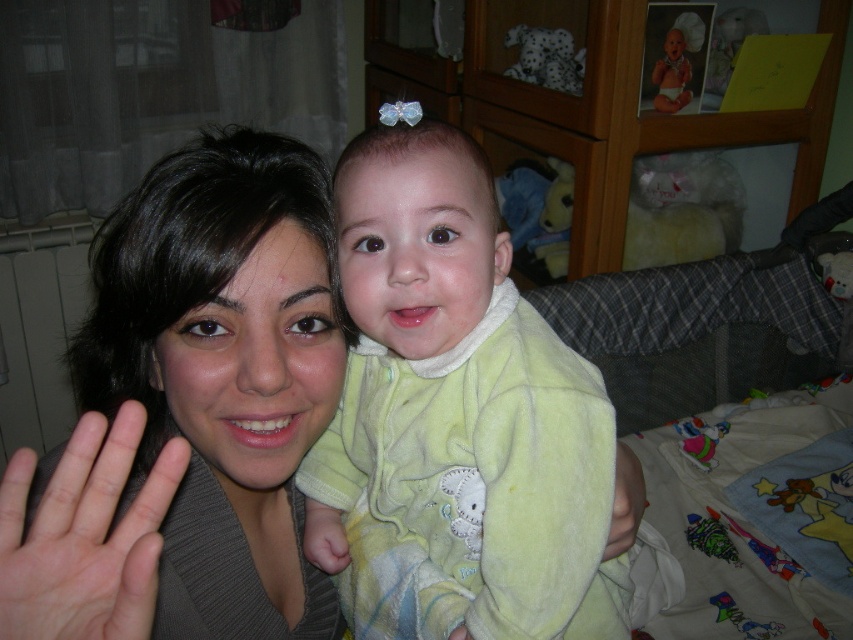
In the scene shown: You are a photographer trying to capture a clear shot of both the light green fleece onesie at center and the matte gray sweater at center. Since the camera can only focus on one object at a time, which object should you focus on to ensure the other remains in the background?

You should focus on the light green fleece onesie at center because the matte gray sweater at center is behind it, so focusing on the front object will keep the sweater in the background within the depth of field.

What is located at the coordinates point (x=459, y=396)?

The light green fleece onesie at center is located at point (x=459, y=396).